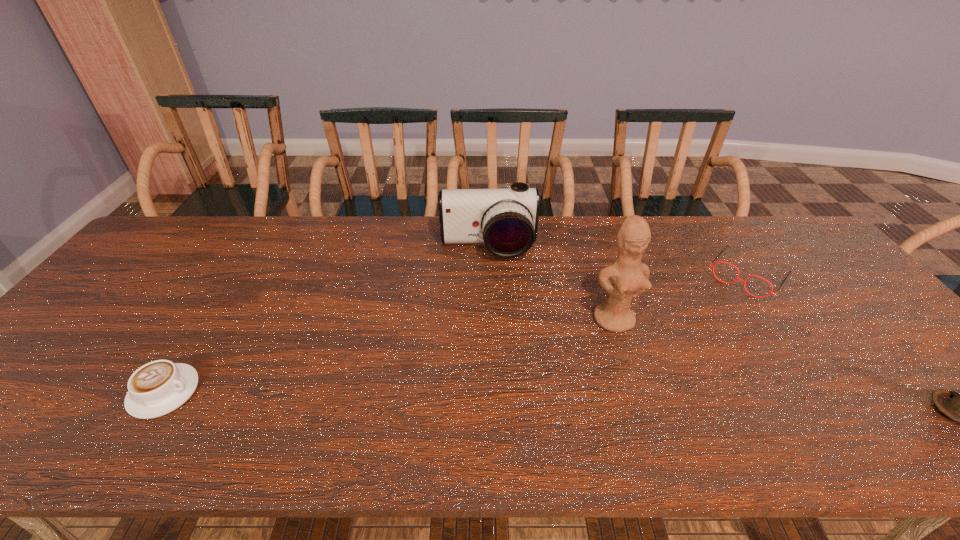
At what (x,y) coordinates should I click in order to perform the action: click on vacant space located 0.380m on the surface of the second object from left to right. Please return your answer as a coordinate pair (x, y). This screenshot has height=540, width=960. Looking at the image, I should click on (498, 364).

Locate an element on the screen. The height and width of the screenshot is (540, 960). vacant space located on the surface of the second object from left to right is located at coordinates (498, 364).

Image resolution: width=960 pixels, height=540 pixels. Identify the location of vacant region located 0.390m on the front-facing side of the spectacles. (666, 380).

This screenshot has width=960, height=540. What are the coordinates of `free space located 0.390m on the front-facing side of the spectacles` in the screenshot? It's located at (666, 380).

In order to click on free space located 0.080m on the front-facing side of the spectacles in this screenshot , I will do `click(720, 310)`.

I want to click on camcorder that is positioned at the far edge, so click(506, 220).

The height and width of the screenshot is (540, 960). In order to click on spectacles located at the far edge in this screenshot , I will do `click(737, 278)`.

This screenshot has width=960, height=540. Find the location of `object present at the near edge`. object present at the near edge is located at coordinates (159, 387).

I want to click on object that is at the right edge, so click(x=737, y=278).

In order to click on object that is at the far right corner in this screenshot , I will do `click(737, 278)`.